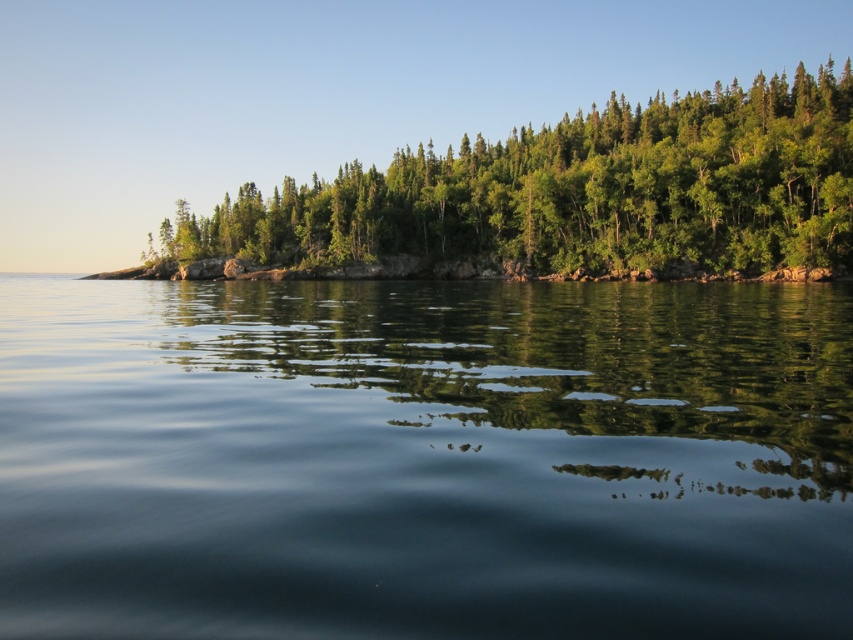
Question: Is transparent water at center bigger than green leafy trees at upper center?

Choices:
 (A) yes
 (B) no

Answer: (B)

Question: Which point is farther to the camera?

Choices:
 (A) (183, 284)
 (B) (442, 168)

Answer: (B)

Question: Which object is farther from the camera taking this photo?

Choices:
 (A) transparent water at center
 (B) green leafy trees at upper center

Answer: (B)

Question: Can you confirm if transparent water at center is bigger than green leafy trees at upper center?

Choices:
 (A) yes
 (B) no

Answer: (B)

Question: In this image, where is transparent water at center located relative to green leafy trees at upper center?

Choices:
 (A) left
 (B) right

Answer: (A)